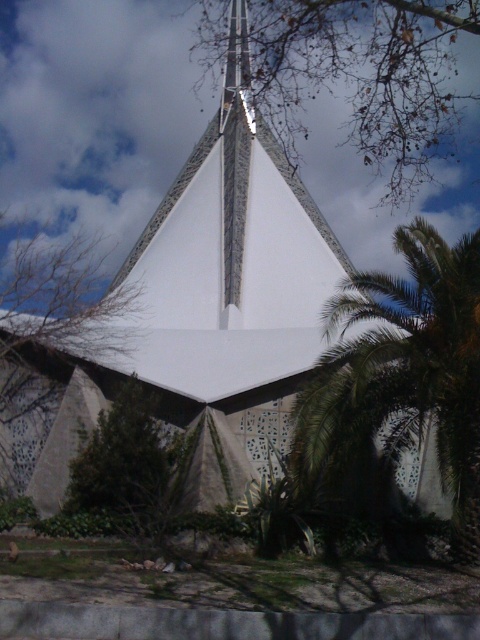
Question: Which object is positioned closest to the green leafy palm tree at center?

Choices:
 (A) brown leafy tree at upper center
 (B) green leafy tree at lower left
 (C) green leafy tree at center

Answer: (B)

Question: Does brown leafy tree at upper center lie in front of green leafy tree at lower left?

Choices:
 (A) yes
 (B) no

Answer: (B)

Question: Is green leafy palm tree at center above brown leafy tree at upper center?

Choices:
 (A) yes
 (B) no

Answer: (B)

Question: Which object is farther from the camera taking this photo?

Choices:
 (A) green leafy tree at lower left
 (B) green leafy palm tree at center
 (C) brown leafy tree at upper center

Answer: (C)

Question: Which point is farther to the camera?

Choices:
 (A) (153, 454)
 (B) (475, 394)

Answer: (A)

Question: In this image, where is brown leafy tree at upper center located relative to green leafy tree at lower left?

Choices:
 (A) below
 (B) above

Answer: (B)